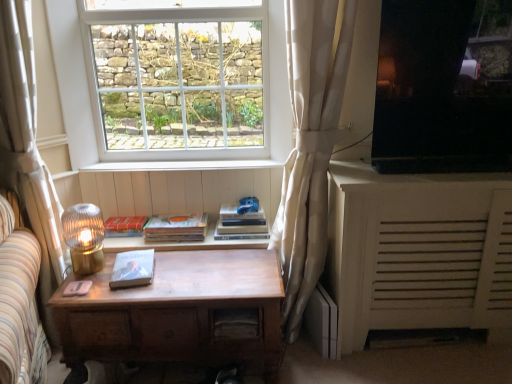
This screenshot has width=512, height=384. What are the coordinates of `free region on the left part of matte red paperback book at center, which is counted as the 1th paperback book, starting from the back` in the screenshot? It's located at (82, 235).